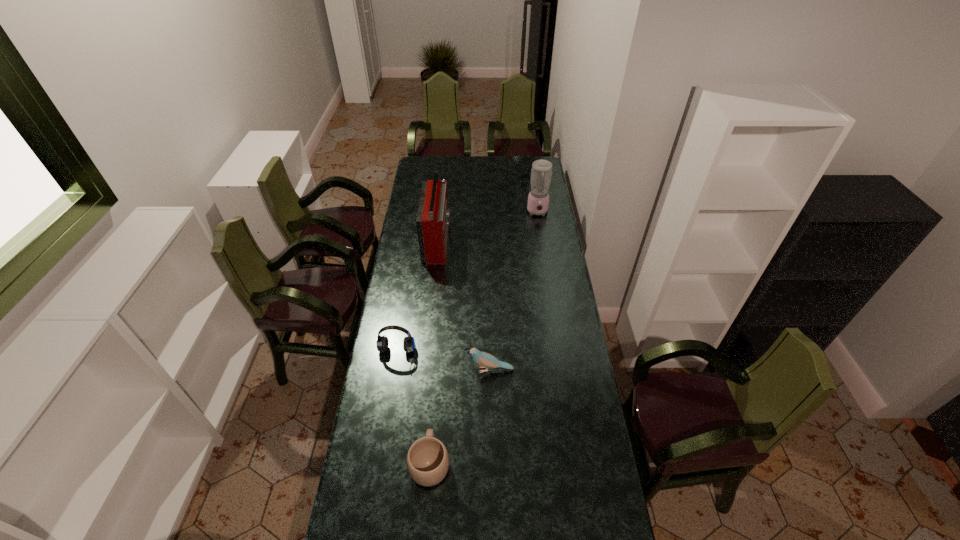
Locate an element on the screen. radio receiver is located at coordinates (432, 221).

Find the location of a particular element. The width and height of the screenshot is (960, 540). the rightmost object is located at coordinates (538, 199).

At what (x,y) coordinates should I click in order to perform the action: click on headset. Please return your answer as a coordinate pair (x, y). The image size is (960, 540). Looking at the image, I should click on (382, 343).

At what (x,y) coordinates should I click in order to perform the action: click on the fourth object from left to right. Please return your answer as a coordinate pair (x, y). This screenshot has width=960, height=540. Looking at the image, I should click on (486, 360).

Where is `the nearest object`? Image resolution: width=960 pixels, height=540 pixels. the nearest object is located at coordinates (427, 460).

Where is `mug`? Image resolution: width=960 pixels, height=540 pixels. mug is located at coordinates (427, 460).

The image size is (960, 540). Identify the location of vacant space positioned 0.380m on the front-facing side of the radio receiver. 522,241.

At what (x,y) coordinates should I click in order to perform the action: click on free spot located 0.250m on the base of the rightmost object near the control knob. Please return your answer as a coordinate pair (x, y). Image resolution: width=960 pixels, height=540 pixels. Looking at the image, I should click on (543, 251).

I want to click on free location located on the ear cushions of the headset, so click(388, 411).

Locate an element on the screen. vacant space located 0.110m at the face of the fourth object from left to right is located at coordinates pyautogui.click(x=437, y=370).